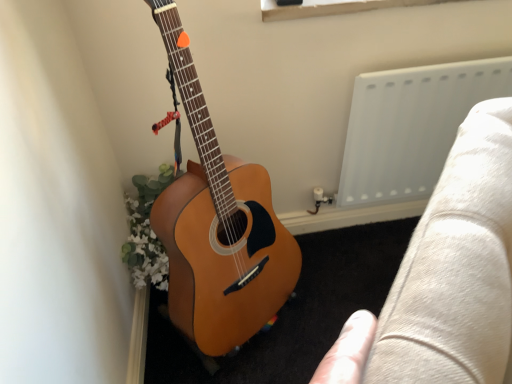
Describe the element at coordinates (411, 126) in the screenshot. Image resolution: width=512 pixels, height=384 pixels. I see `white plastic radiator at upper right` at that location.

What are the coordinates of `white plastic radiator at upper right` in the screenshot? It's located at (411, 126).

Locate an element on the screen. The width and height of the screenshot is (512, 384). white plastic radiator at upper right is located at coordinates (411, 126).